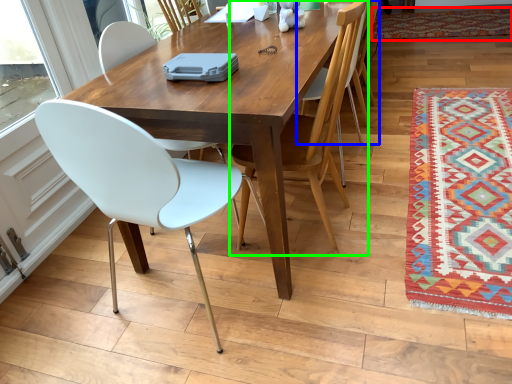
Question: Based on their relative distances, which object is nearer to mat (highlighted by a red box)? Choose from chair (highlighted by a blue box) and chair (highlighted by a green box).

Choices:
 (A) chair
 (B) chair

Answer: (A)